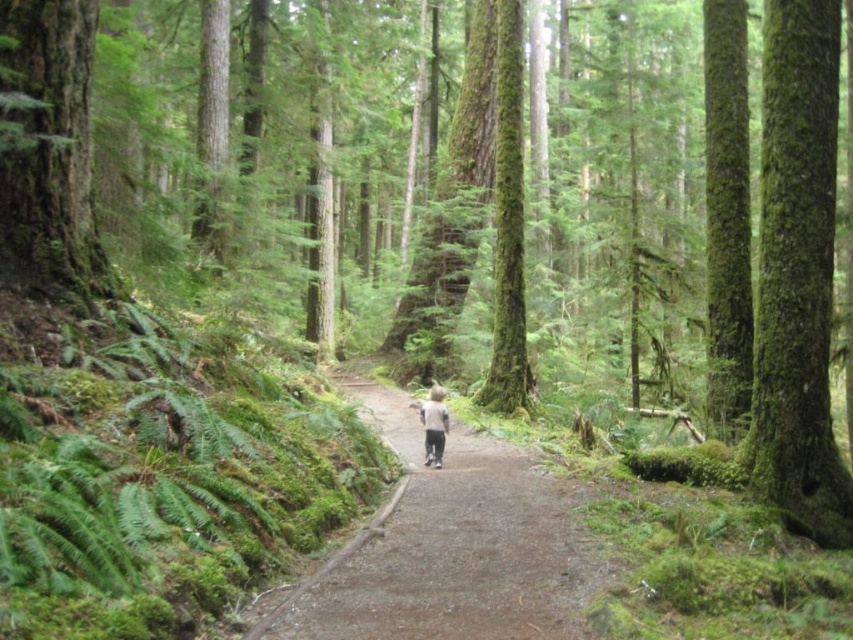
You are a hiker who wants to follow the dirt path at center to reach a hidden waterfall. There is a green mossy tree at left blocking your view. Which direction should you walk to stay on the path while avoiding the tree?

The dirt path at center is located below the green mossy tree at left, so you should walk forward along the path below the tree to stay on course and avoid the tree.

You are a hiker who wants to take a photo of both the green mossy tree trunk at right and the green mossy tree at left. Which tree should you stand closer to in order to capture both in a single frame?

You should stand closer to the green mossy tree at left because it is shorter than the green mossy tree trunk at right, allowing both to fit within the camera frame when positioned appropriately.

You are a hiker carrying a 3 meter wide tent. You want to set up camp between the green mossy tree trunk at right and the green mossy tree at left. Is there enough space to place your tent without it overlapping either tree?

The distance between the green mossy tree trunk at right and green mossy tree at left is 6.88 meters. Since the tent is 3 meters wide, there is sufficient space as 6.88 meters is greater than 3 meters.